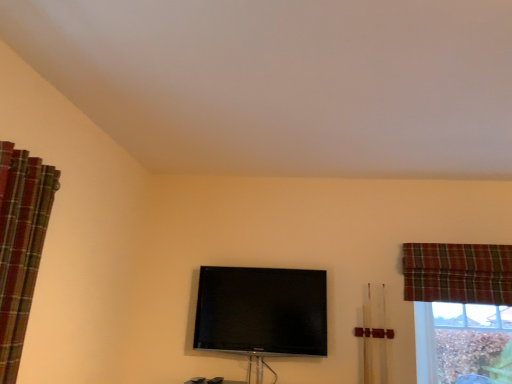
Question: Considering the positions of brown textured wood at lower right and matte black tv at center in the image, is brown textured wood at lower right wider or thinner than matte black tv at center?

Choices:
 (A) thin
 (B) wide

Answer: (A)

Question: Is point (462, 360) closer or farther from the camera than point (217, 380)?

Choices:
 (A) farther
 (B) closer

Answer: (A)

Question: Which of these objects is positioned closest to the flat screen tv at center?

Choices:
 (A) plaid fabric curtain at left, marked as the 2th curtain in a right-to-left arrangement
 (B) matte black tv at center
 (C) plaid fabric curtain at upper right, which is counted as the 1th curtain, starting from the right
 (D) brown textured wood at lower right

Answer: (B)

Question: Estimate the real-world distances between objects in this image. Which object is closer to the matte black tv at center?

Choices:
 (A) plaid fabric curtain at upper right, placed as the 2th curtain when sorted from front to back
 (B) brown textured wood at lower right
 (C) plaid fabric curtain at left, acting as the 1th curtain starting from the front
 (D) flat screen tv at center

Answer: (D)